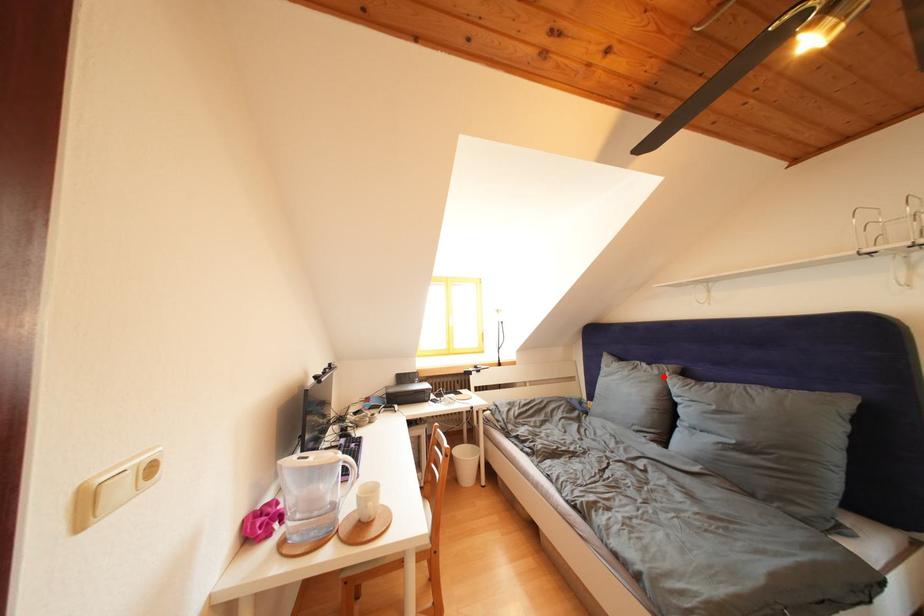
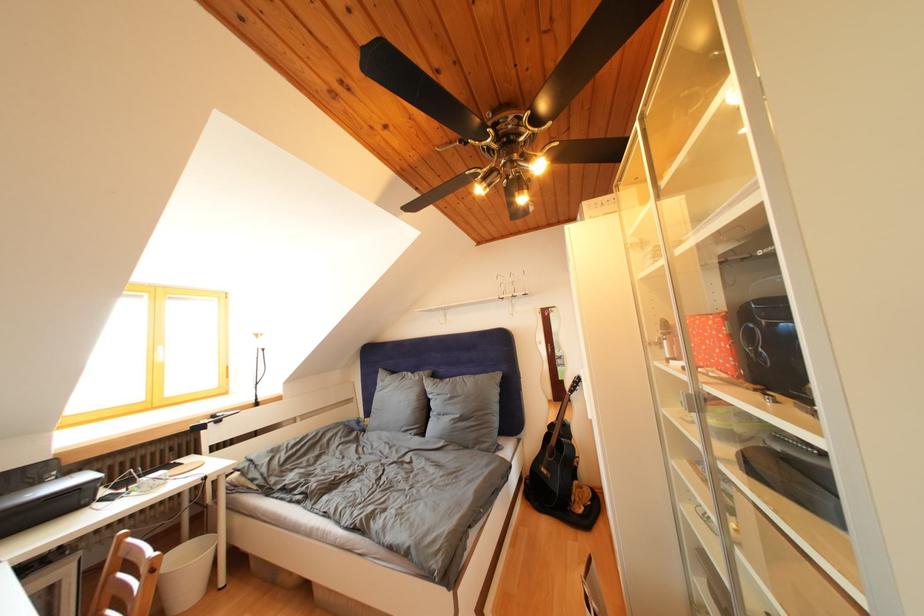
Question: I am providing you with two images of the same scene from different viewpoints. A red point is marked on the first image. At the location where the point appears in image 1, is it still visible in image 2?

Choices:
 (A) Yes
 (B) No

Answer: (A)